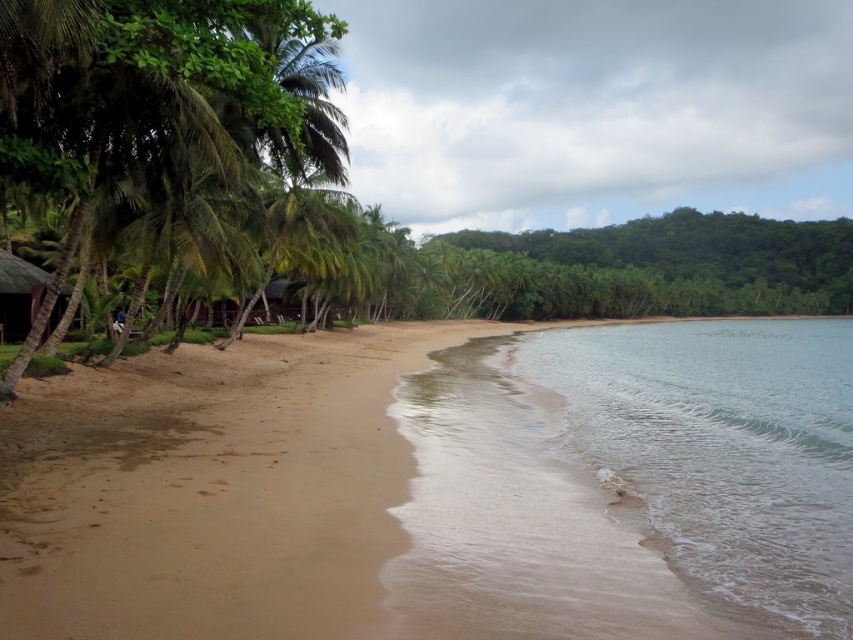
Which is above, brown sandy beach at center or dark brown wooden hut at left?

Positioned higher is dark brown wooden hut at left.

Which is in front, point (270, 449) or point (13, 276)?

Positioned in front is point (270, 449).

Describe the element at coordinates (210, 488) in the screenshot. I see `brown sandy beach at center` at that location.

This screenshot has height=640, width=853. I want to click on brown sandy beach at center, so click(x=210, y=488).

Can you confirm if clear water at lower right is bigger than dark brown wooden hut at left?

Correct, clear water at lower right is larger in size than dark brown wooden hut at left.

Which is behind, point (762, 502) or point (39, 291)?

Positioned behind is point (39, 291).

The image size is (853, 640). Find the location of `clear water at lower right`. clear water at lower right is located at coordinates (720, 452).

Who is positioned more to the right, brown sandy beach at center or clear water at lower right?

clear water at lower right is more to the right.

Which is above, brown sandy beach at center or clear water at lower right?

brown sandy beach at center

Who is more distant from viewer, (19,401) or (648,456)?

Positioned behind is point (648,456).

The height and width of the screenshot is (640, 853). Find the location of `brown sandy beach at center`. brown sandy beach at center is located at coordinates (210, 488).